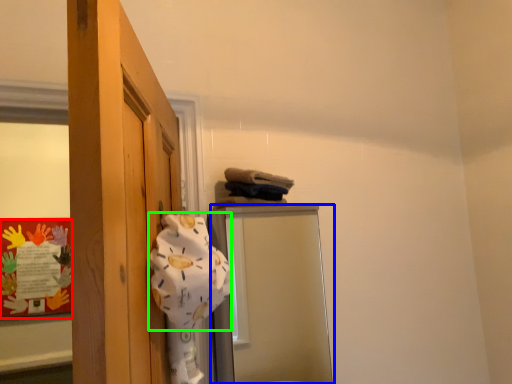
Question: Which object is the farthest from bulletin board (highlighted by a red box)? Choose among these: mirror (highlighted by a blue box) or bath towel (highlighted by a green box).

Choices:
 (A) mirror
 (B) bath towel

Answer: (B)